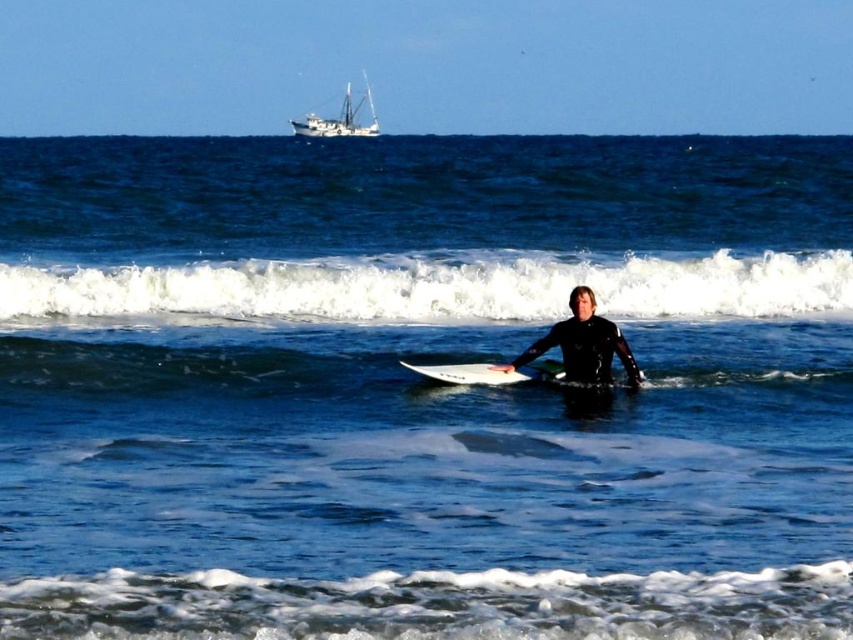
Consider the image. Can you confirm if white foamy wave at center is positioned above white matte boat at upper center?

Incorrect, white foamy wave at center is not positioned above white matte boat at upper center.

Looking at this image, does white foamy wave at center have a lesser height compared to white matte boat at upper center?

Indeed, white foamy wave at center has a lesser height compared to white matte boat at upper center.

Image resolution: width=853 pixels, height=640 pixels. Identify the location of white foamy wave at center. (427, 288).

Image resolution: width=853 pixels, height=640 pixels. In order to click on white foamy wave at center in this screenshot , I will do `click(427, 288)`.

Is white foamy wave at center bigger than white glossy surfboard at center?

Correct, white foamy wave at center is larger in size than white glossy surfboard at center.

What do you see at coordinates (427, 288) in the screenshot? I see `white foamy wave at center` at bounding box center [427, 288].

Where is `white foamy wave at center`? The width and height of the screenshot is (853, 640). white foamy wave at center is located at coordinates (427, 288).

Does white glossy surfboard at center have a greater height compared to white matte boat at upper center?

No, white glossy surfboard at center is not taller than white matte boat at upper center.

Is point (438, 372) in front of point (300, 120)?

Yes, point (438, 372) is in front of point (300, 120).

What do you see at coordinates (489, 372) in the screenshot?
I see `white glossy surfboard at center` at bounding box center [489, 372].

I want to click on white glossy surfboard at center, so click(489, 372).